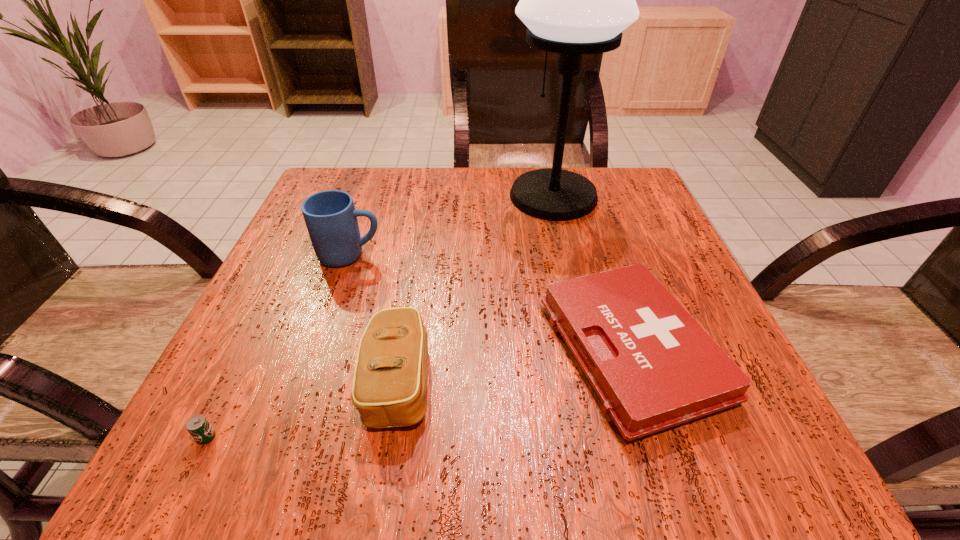
Locate an element on the screen. blank space that satisfies the following two spatial constraints: 1. on the side of the second shortest object with the handle; 2. on the left side of the second object from left to right is located at coordinates (318, 351).

The image size is (960, 540). In order to click on free space that satisfies the following two spatial constraints: 1. on the zipper side of the third tallest object; 2. on the front side of the beer can in this screenshot , I will do `click(390, 437)`.

Identify the location of vacant area that satisfies the following two spatial constraints: 1. on the front side of the farthest object; 2. on the right side of the first-aid kit. (588, 351).

The width and height of the screenshot is (960, 540). Identify the location of free space that satisfies the following two spatial constraints: 1. on the side of the mug with the handle; 2. on the left side of the fourth tallest object. (318, 351).

This screenshot has width=960, height=540. I want to click on vacant space that satisfies the following two spatial constraints: 1. on the front side of the farthest object; 2. on the side of the second farthest object with the handle, so click(x=566, y=255).

At what (x,y) coordinates should I click in order to perform the action: click on vacant area in the image that satisfies the following two spatial constraints: 1. on the back side of the beer can; 2. on the right side of the first-aid kit. Please return your answer as a coordinate pair (x, y). Looking at the image, I should click on (249, 351).

The image size is (960, 540). In order to click on free space in the image that satisfies the following two spatial constraints: 1. on the back side of the first-aid kit; 2. on the side of the second tallest object with the handle in this screenshot , I will do `click(600, 255)`.